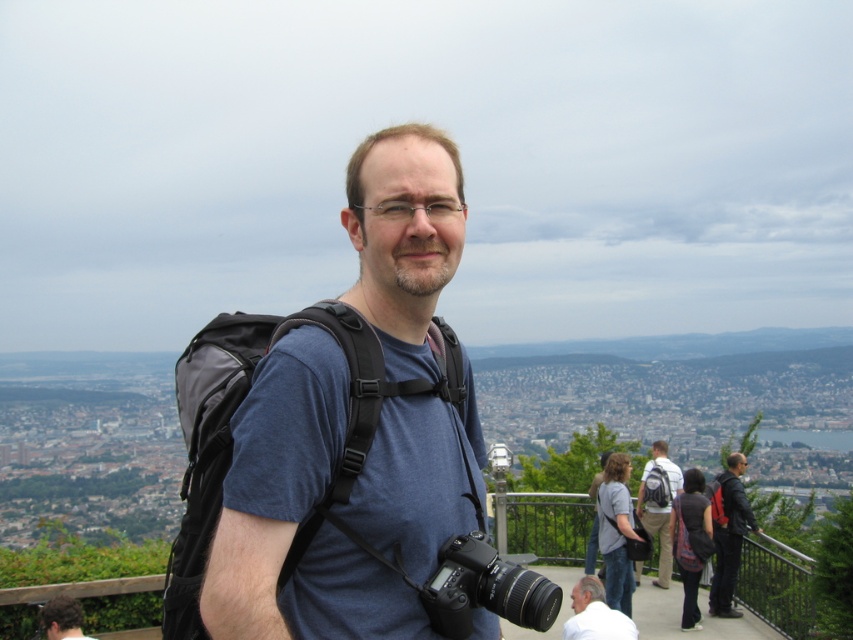
Question: Among these points, which one is nearest to the camera?

Choices:
 (A) (735, 504)
 (B) (720, 483)
 (C) (621, 614)
 (D) (668, 508)

Answer: (C)

Question: Is white matte shirt at lower right thinner than matte black backpack at center?

Choices:
 (A) no
 (B) yes

Answer: (A)

Question: Considering the real-world distances, which object is farthest from the matte blue shirt at center?

Choices:
 (A) matte black backpack at center
 (B) black fabric backpack at center-right

Answer: (A)

Question: Does black leather jacket at right appear over matte black backpack at center?

Choices:
 (A) no
 (B) yes

Answer: (B)

Question: Which point is farther to the camera?

Choices:
 (A) (724, 518)
 (B) (625, 625)
 (C) (752, 520)
 (D) (590, 548)

Answer: (D)

Question: Does black plastic camera at center have a lesser width compared to matte blue shirt at center?

Choices:
 (A) yes
 (B) no

Answer: (B)